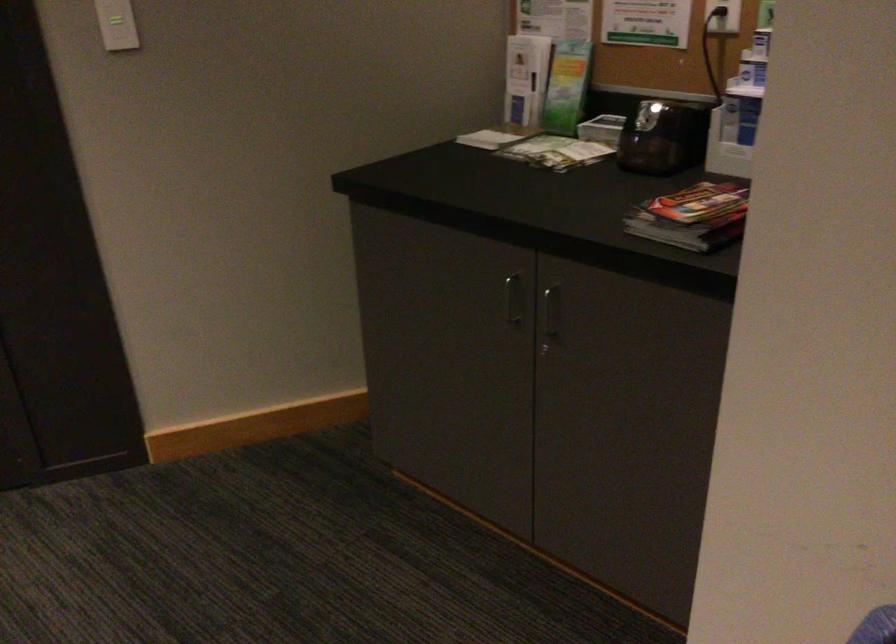
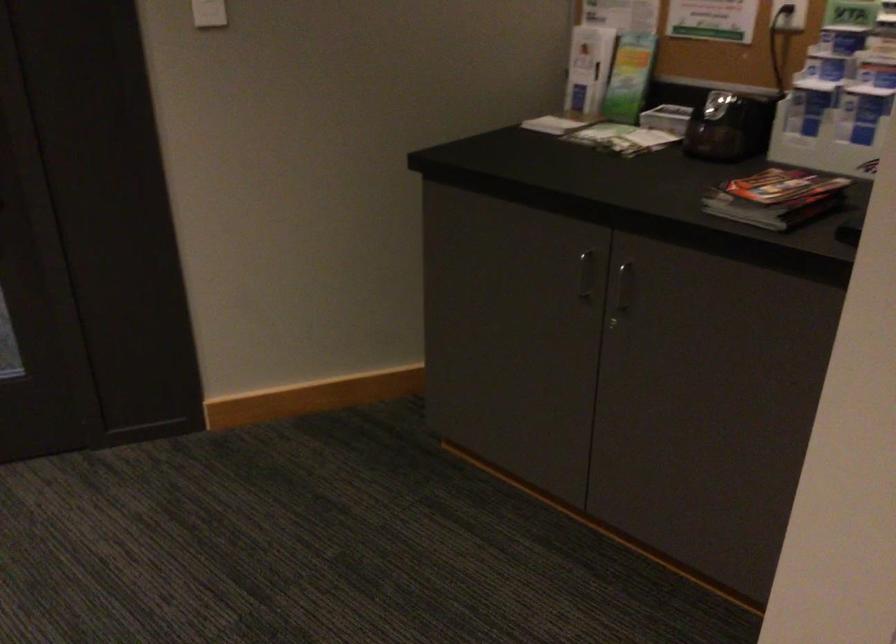
In the second image, find the point that corresponds to [495,136] in the first image.

(556, 122)